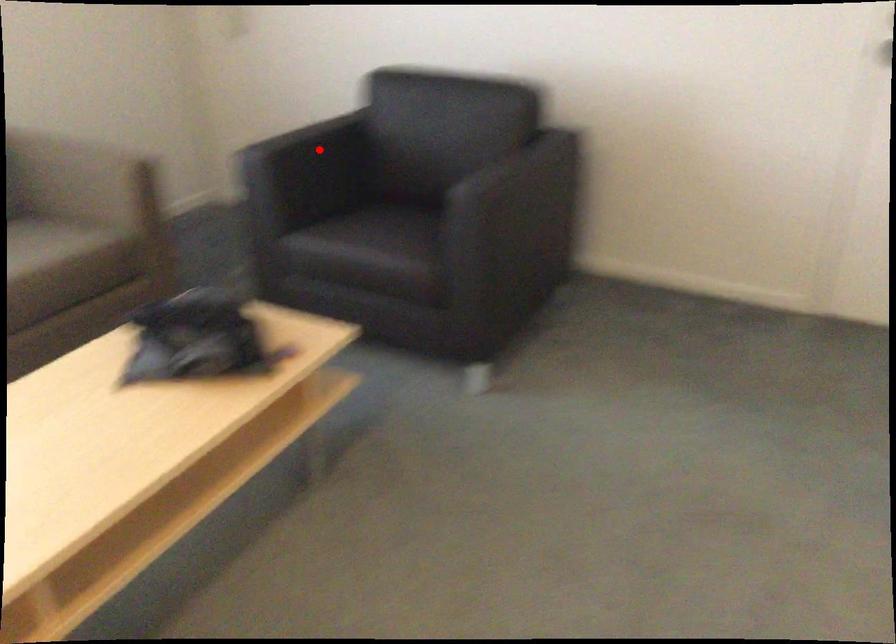
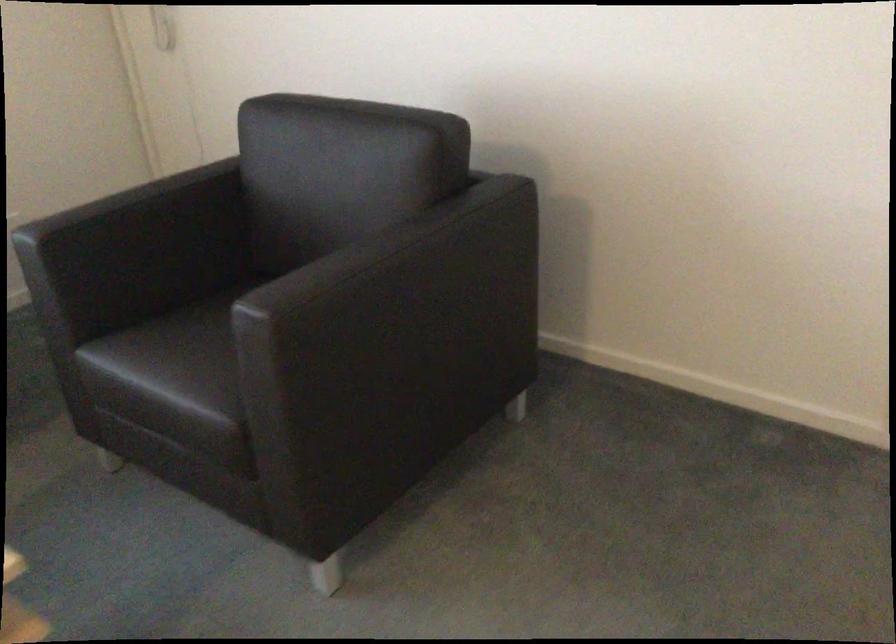
Question: I am providing you with two images of the same scene from different viewpoints. Image1 has a red point marked. In image2, the corresponding 3D location appears at what relative position? Reply with the corresponding letter.

Choices:
 (A) Closer
 (B) Farther

Answer: (A)